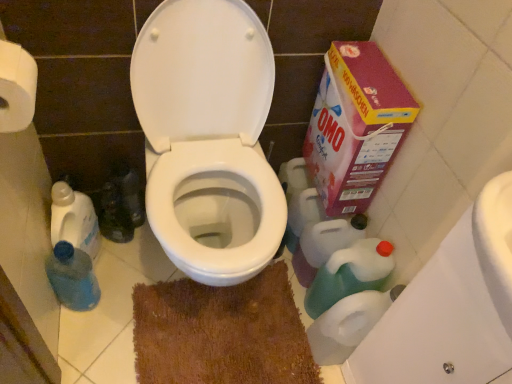
Identify the location of vacant space in front of blue plastic bottle at lower left, marked as the 2th cleaning product in a left-to-right arrangement. Image resolution: width=512 pixels, height=384 pixels. (81, 344).